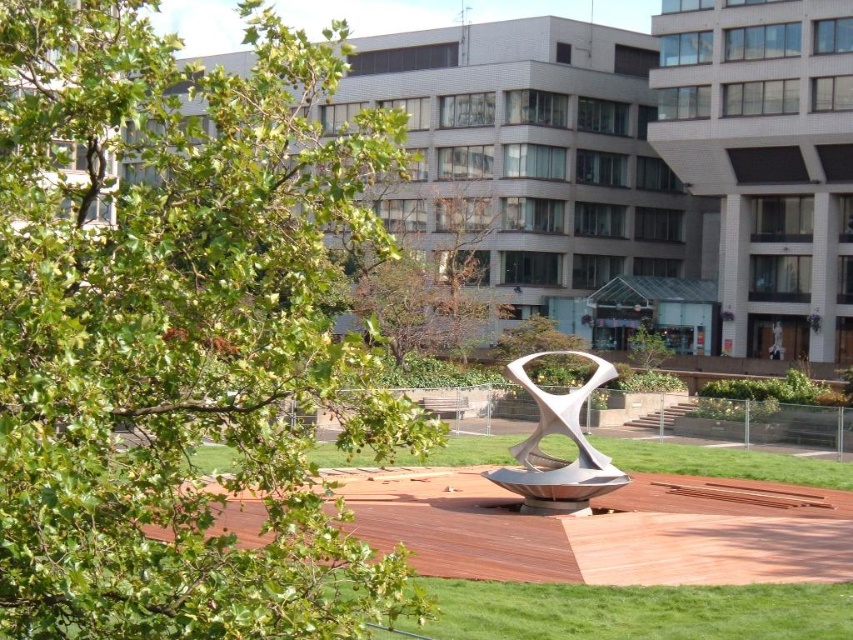
Who is higher up, brown leafy tree at center or green grass at center?

brown leafy tree at center

Identify the location of brown leafy tree at center. The image size is (853, 640). (433, 284).

Is green grass at lower center below green grass at center?

Yes.

Does green grass at lower center have a larger size compared to green grass at center?

No.

Who is more forward, (744, 595) or (843, 481)?

Point (744, 595) is in front.

The height and width of the screenshot is (640, 853). In order to click on green grass at lower center in this screenshot , I will do `click(636, 611)`.

Is green grass at lower center above satin silver sculpture at center?

Actually, green grass at lower center is below satin silver sculpture at center.

Can you confirm if green grass at lower center is smaller than satin silver sculpture at center?

Indeed, green grass at lower center has a smaller size compared to satin silver sculpture at center.

Identify the location of green grass at lower center. (636, 611).

This screenshot has height=640, width=853. In order to click on green grass at lower center in this screenshot , I will do `click(636, 611)`.